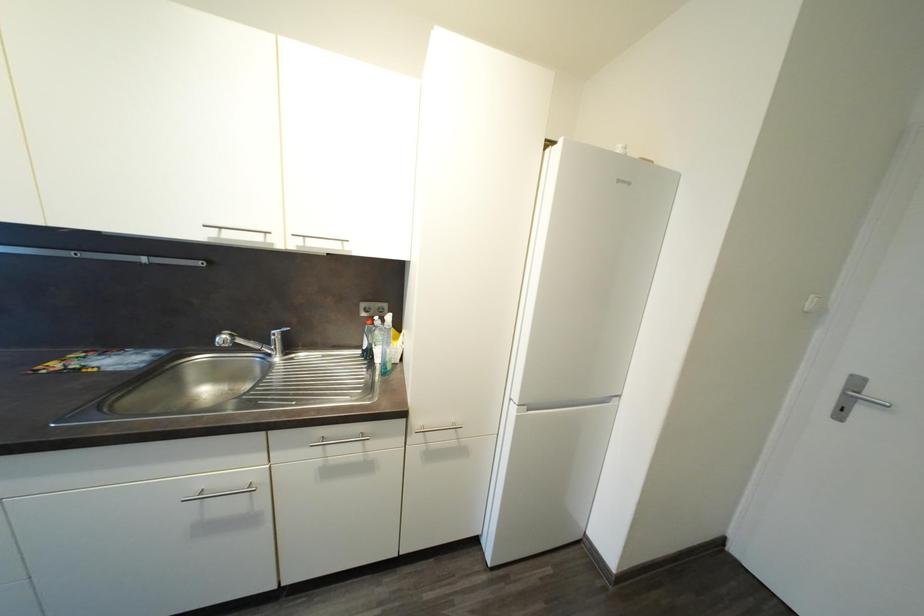
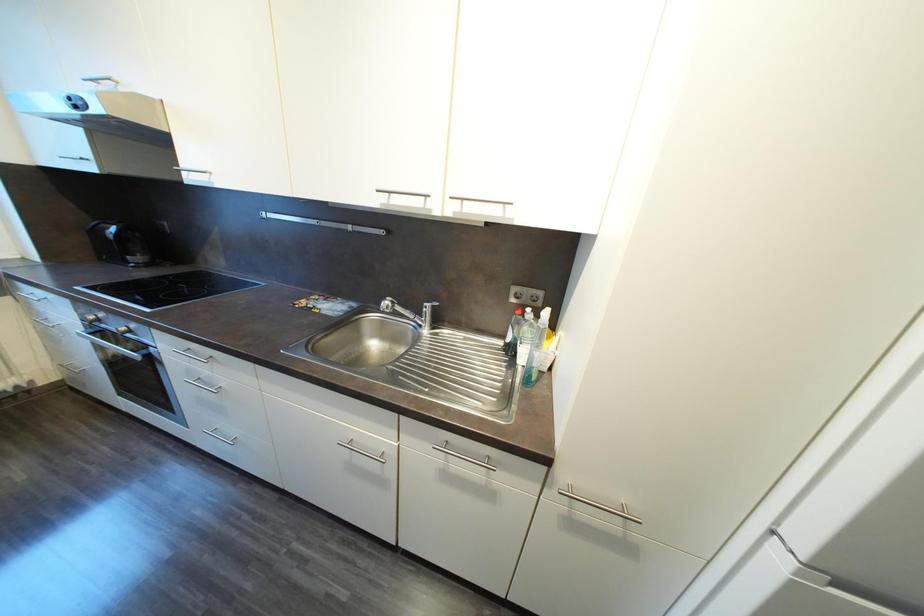
Question: The camera is either moving clockwise (left) or counter-clockwise (right) around the object. The first image is from the beginning of the video and the second image is from the end. Is the camera moving left or right when shooting the video?

Choices:
 (A) Left
 (B) Right

Answer: (B)